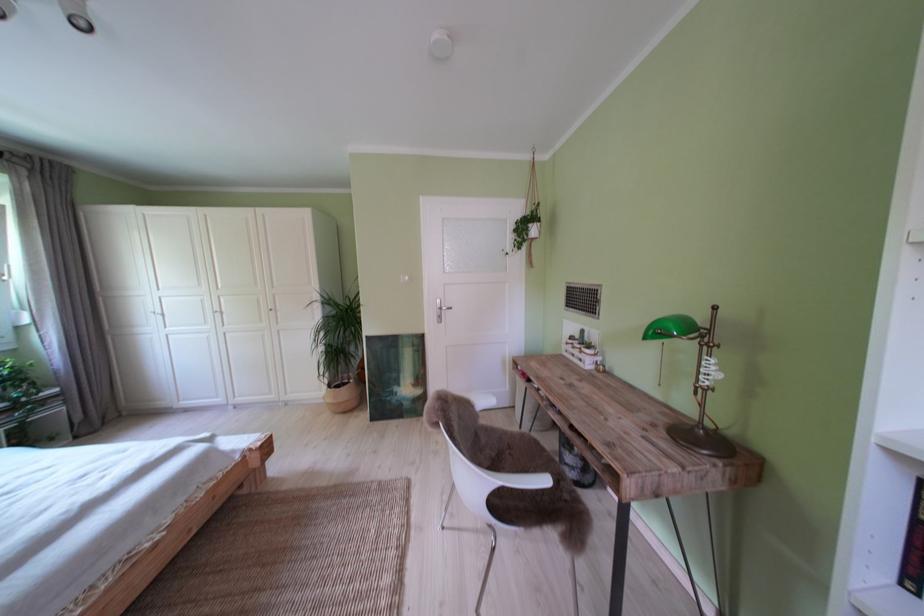
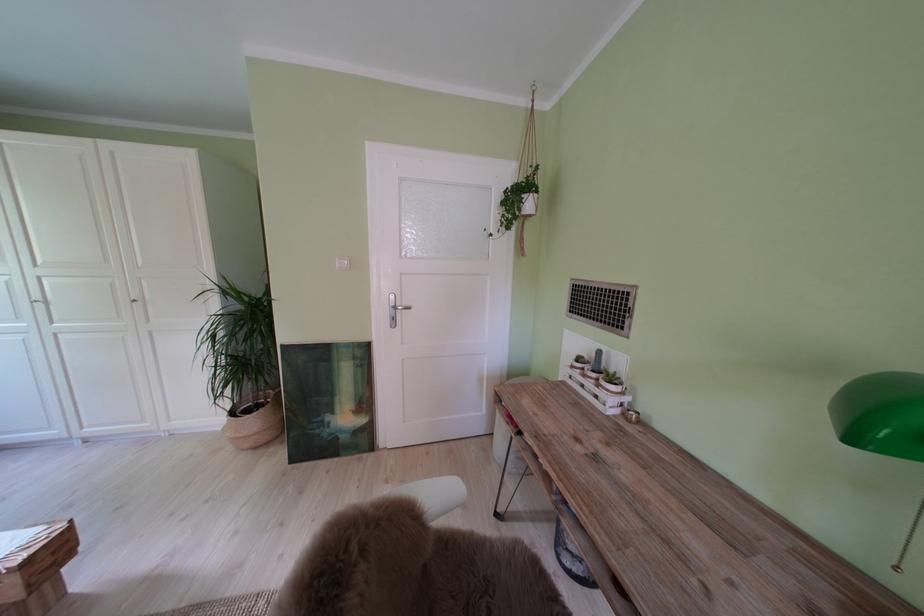
Where in the second image is the point corresponding to the point at 590,352 from the first image?

(604, 381)